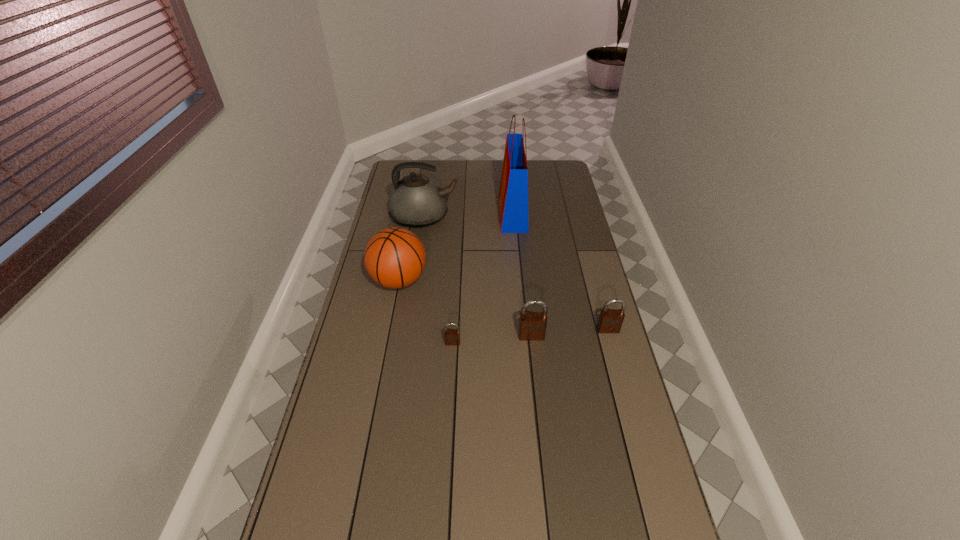
Identify the location of the shortest object. tap(452, 336).

The width and height of the screenshot is (960, 540). In order to click on the leftmost padlock in this screenshot , I will do `click(452, 336)`.

What are the coordinates of `the second padlock from left to right` in the screenshot? It's located at (532, 326).

I want to click on the second tallest padlock, so click(x=610, y=320).

This screenshot has height=540, width=960. I want to click on the rightmost padlock, so click(610, 320).

Where is `basketball`? This screenshot has height=540, width=960. basketball is located at coordinates (394, 257).

I want to click on the fourth nearest object, so 394,257.

The width and height of the screenshot is (960, 540). I want to click on the tallest object, so click(513, 194).

Where is `kettle`? The height and width of the screenshot is (540, 960). kettle is located at coordinates (416, 201).

Locate an element on the screen. vacant region located 0.320m on the front-facing side of the shortest object is located at coordinates (447, 436).